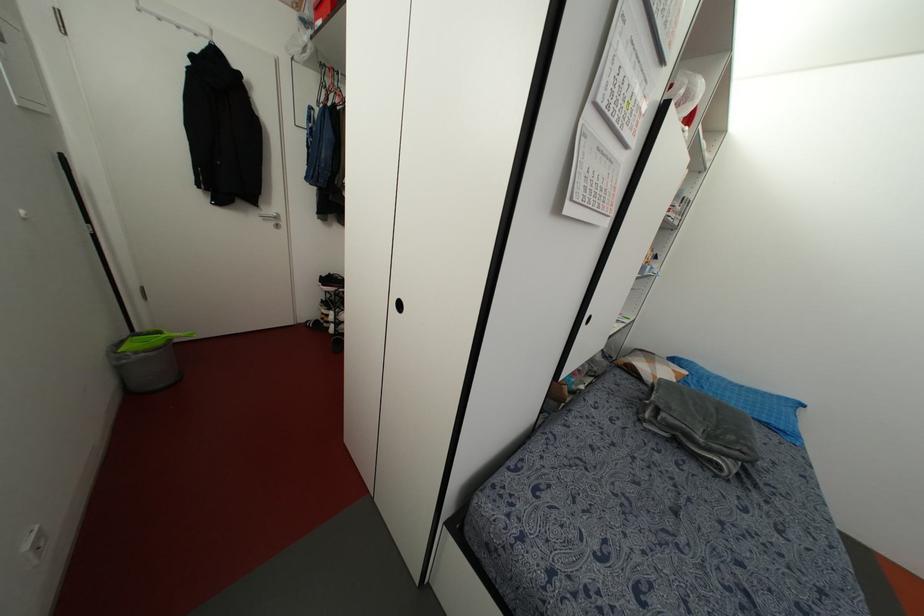
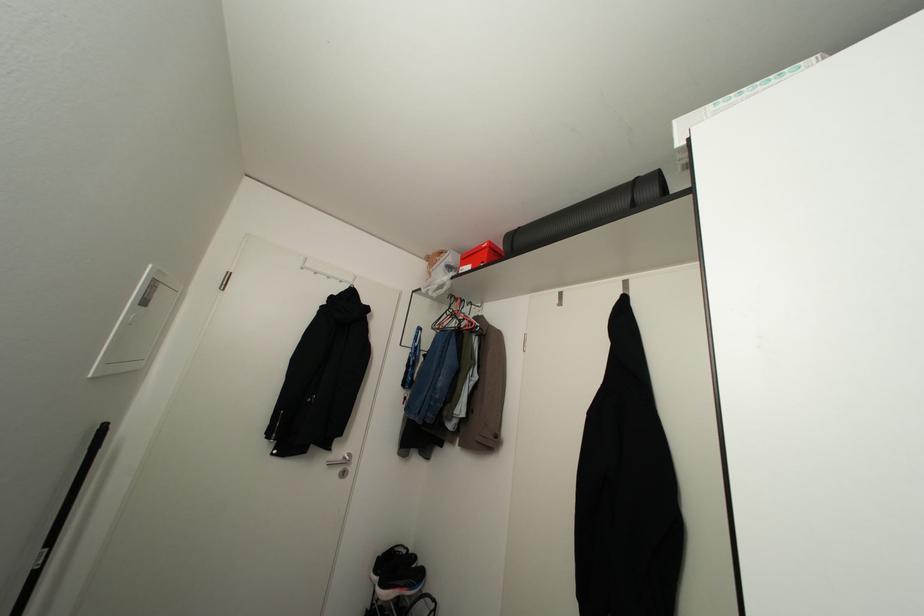
The point at (88, 221) is marked in the first image. Where is the corresponding point in the second image?

(50, 541)